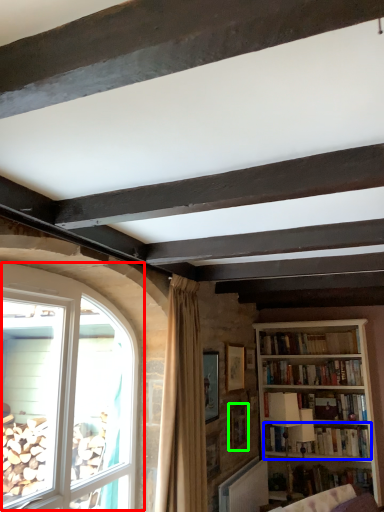
Question: Which is farther away from window (highlighted by a red box)? book (highlighted by a blue box) or picture frame (highlighted by a green box)?

Choices:
 (A) book
 (B) picture frame

Answer: (A)